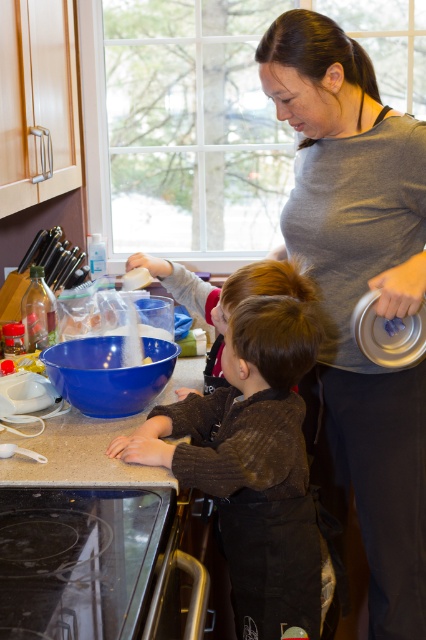
Question: Does blue plastic bowl at center appear over smooth brown hair at center?

Choices:
 (A) no
 (B) yes

Answer: (A)

Question: Which of the following is the farthest from the observer?

Choices:
 (A) gray matte shirt at upper center
 (B) brown fuzzy sweater at center
 (C) blue plastic bowl at center

Answer: (C)

Question: Which of these objects is positioned closest to the blue plastic bowl at center?

Choices:
 (A) brown fuzzy sweater at center
 (B) smooth brown hair at center

Answer: (B)

Question: Can you confirm if gray matte shirt at upper center is thinner than blue plastic bowl at center?

Choices:
 (A) yes
 (B) no

Answer: (B)

Question: Which is nearer to the smooth granite countertop at lower center?

Choices:
 (A) smooth brown hair at center
 (B) blue plastic bowl at center

Answer: (B)

Question: Is brown fuzzy sweater at center smaller than smooth brown hair at center?

Choices:
 (A) no
 (B) yes

Answer: (B)